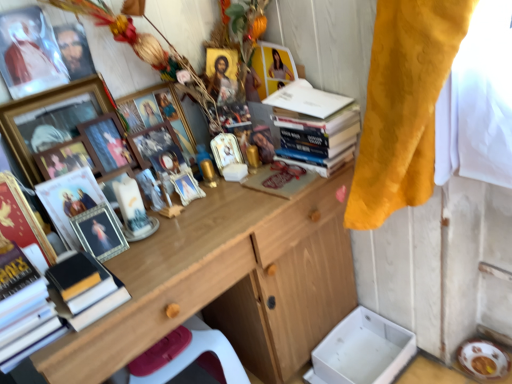
Identify the location of vacant space to the right of matte glass picture frame at center, which appears as the sixth picture frame when viewed from the left. Image resolution: width=512 pixels, height=384 pixels. (196, 223).